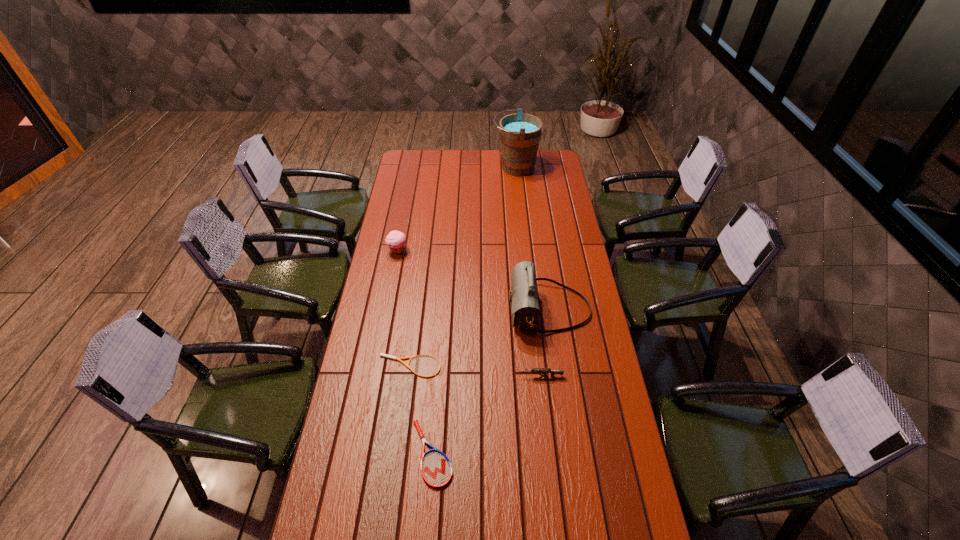
The height and width of the screenshot is (540, 960). What are the coordinates of `vacant area that lies between the nearest object and the wine bucket` in the screenshot? It's located at (473, 310).

The width and height of the screenshot is (960, 540). I want to click on free space between the farther tennis racket and the fifth nearest object, so (x=404, y=309).

Find the location of a particular element. free space between the nearest object and the cupcake is located at coordinates (415, 352).

Locate an element on the screen. The width and height of the screenshot is (960, 540). empty space that is in between the fourth shortest object and the wine bucket is located at coordinates (457, 209).

In order to click on vacant space in between the nearest object and the gun in this screenshot , I will do `click(487, 414)`.

The image size is (960, 540). I want to click on empty space that is in between the nearer tennis racket and the gun, so click(x=487, y=414).

Where is `vacant area between the shoulder bag and the nearest object`? The height and width of the screenshot is (540, 960). vacant area between the shoulder bag and the nearest object is located at coordinates (491, 381).

This screenshot has height=540, width=960. In order to click on blank region between the fifth shortest object and the wine bucket in this screenshot , I will do `click(532, 238)`.

The height and width of the screenshot is (540, 960). What are the coordinates of `the third closest object relative to the fourth tallest object` in the screenshot? It's located at (436, 469).

Choose which object is the third nearest neighbor to the farther tennis racket. Please provide its 2D coordinates. Your answer should be formatted as a tuple, i.e. [(x, y)], where the tuple contains the x and y coordinates of a point satisfying the conditions above.

[(552, 372)]